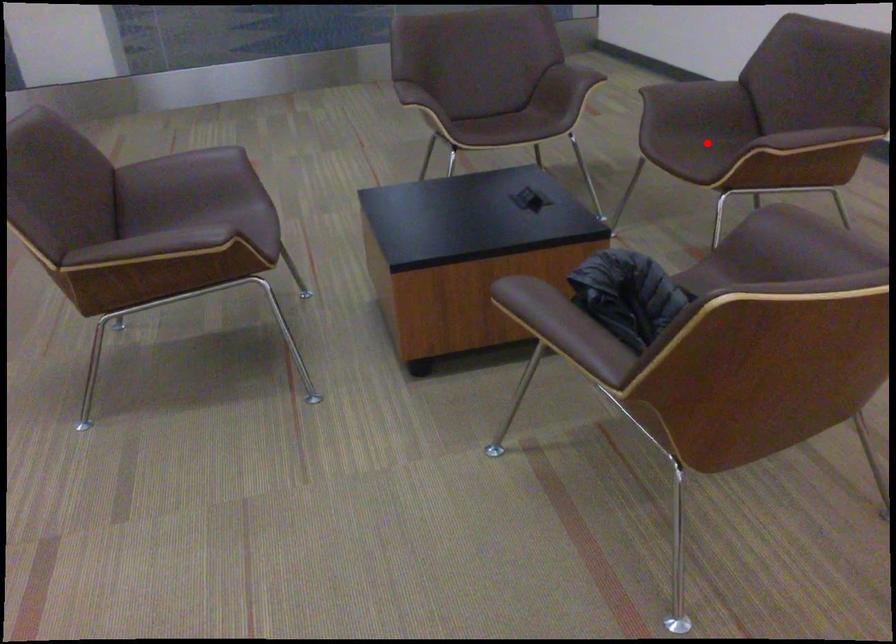
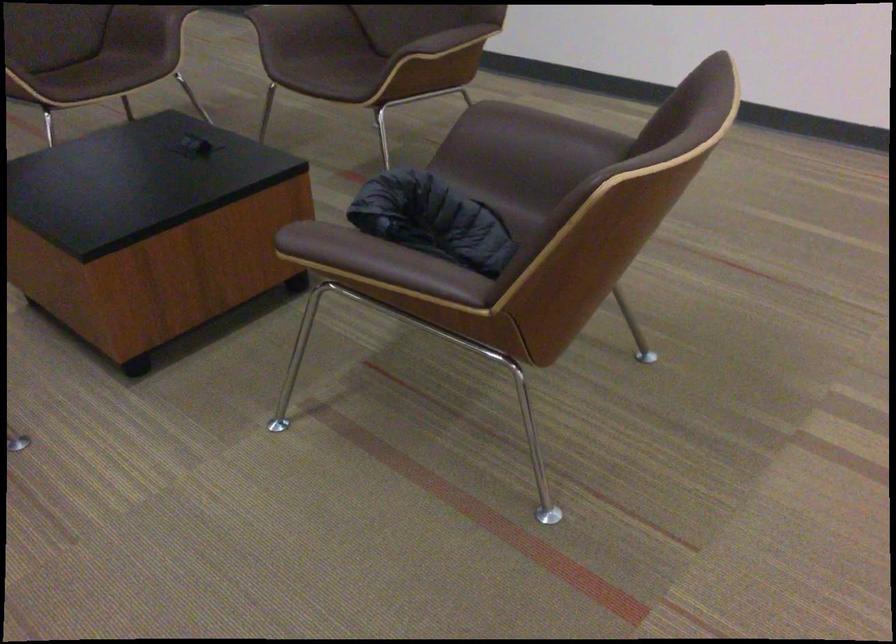
Locate, in the second image, the point that corresponds to the highlighted location in the first image.

(343, 70)